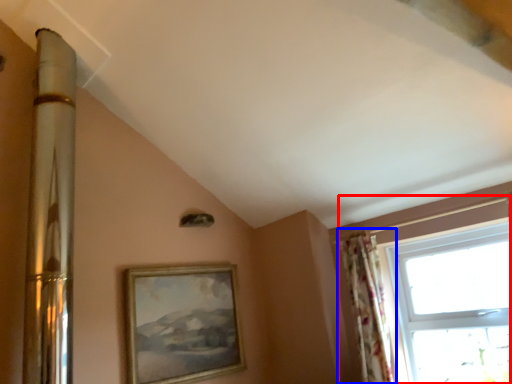
Question: Which point is closer to the camera, window (highlighted by a red box) or curtain (highlighted by a blue box)?

Choices:
 (A) window
 (B) curtain

Answer: (A)